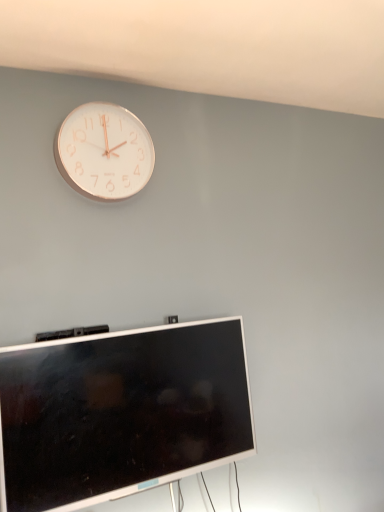
Image resolution: width=384 pixels, height=512 pixels. In order to click on silver metallic television at lower center in this screenshot , I will do `click(120, 413)`.

What do you see at coordinates (120, 413) in the screenshot?
I see `silver metallic television at lower center` at bounding box center [120, 413].

This screenshot has height=512, width=384. What do you see at coordinates (104, 152) in the screenshot? I see `white metallic clock at upper left` at bounding box center [104, 152].

You are a GUI agent. You are given a task and a screenshot of the screen. Output one action in this format:
    pyautogui.click(x=<x>, y=<y>)
    Task: Click on the white metallic clock at upper left
    The image size is (384, 512).
    Given the screenshot: What is the action you would take?
    click(x=104, y=152)

Find the location of a particular element. silver metallic television at lower center is located at coordinates (120, 413).

Which is more to the right, silver metallic television at lower center or white metallic clock at upper left?

From the viewer's perspective, silver metallic television at lower center appears more on the right side.

Is silver metallic television at lower center closer to the viewer compared to white metallic clock at upper left?

Yes, it is.

Is point (59, 365) farther from viewer compared to point (128, 174)?

No, it is in front of (128, 174).

From the image's perspective, would you say silver metallic television at lower center is shown under white metallic clock at upper left?

Yes, from the image's perspective, silver metallic television at lower center is beneath white metallic clock at upper left.

From a real-world perspective, which is physically above, silver metallic television at lower center or white metallic clock at upper left?

white metallic clock at upper left, from a real-world perspective.

Considering the sizes of silver metallic television at lower center and white metallic clock at upper left in the image, is silver metallic television at lower center wider or thinner than white metallic clock at upper left?

In the image, silver metallic television at lower center appears to be wider than white metallic clock at upper left.

Between silver metallic television at lower center and white metallic clock at upper left, which one has less height?

white metallic clock at upper left.

Can you confirm if silver metallic television at lower center is bigger than white metallic clock at upper left?

Indeed, silver metallic television at lower center has a larger size compared to white metallic clock at upper left.

Would you say white metallic clock at upper left is part of silver metallic television at lower center's contents?

No.

Is silver metallic television at lower center far away from white metallic clock at upper left?

silver metallic television at lower center is near white metallic clock at upper left, not far away.

Is silver metallic television at lower center facing away from white metallic clock at upper left?

No, silver metallic television at lower center is not facing the opposite direction of white metallic clock at upper left.

Measure the distance between silver metallic television at lower center and white metallic clock at upper left.

silver metallic television at lower center and white metallic clock at upper left are 23.86 inches apart.

I want to click on wall clock located above the silver metallic television at lower center (from a real-world perspective), so click(104, 152).

Considering the relative positions of white metallic clock at upper left and silver metallic television at lower center in the image provided, is white metallic clock at upper left to the left of silver metallic television at lower center from the viewer's perspective?

Indeed, white metallic clock at upper left is positioned on the left side of silver metallic television at lower center.

Is the depth of white metallic clock at upper left greater than that of silver metallic television at lower center?

Yes, the depth of white metallic clock at upper left is greater than that of silver metallic television at lower center.

Considering the points (100, 181) and (13, 357), which point is in front, point (100, 181) or point (13, 357)?

Positioned in front is point (13, 357).

From the image's perspective, does white metallic clock at upper left appear lower than silver metallic television at lower center?

No, from the image's perspective, white metallic clock at upper left is not beneath silver metallic television at lower center.

From a real-world perspective, is white metallic clock at upper left positioned above or below silver metallic television at lower center?

In terms of real-world spatial position, white metallic clock at upper left is above silver metallic television at lower center.

Is white metallic clock at upper left thinner than silver metallic television at lower center?

Yes.

Based on the photo, considering the sizes of objects white metallic clock at upper left and silver metallic television at lower center in the image provided, who is shorter, white metallic clock at upper left or silver metallic television at lower center?

Standing shorter between the two is white metallic clock at upper left.

Considering the sizes of white metallic clock at upper left and silver metallic television at lower center in the image, is white metallic clock at upper left bigger or smaller than silver metallic television at lower center?

white metallic clock at upper left is smaller than silver metallic television at lower center.

Is white metallic clock at upper left completely or partially outside of silver metallic television at lower center?

Yes, white metallic clock at upper left is located beyond the bounds of silver metallic television at lower center.

Can you see white metallic clock at upper left touching silver metallic television at lower center?

No, white metallic clock at upper left is not beside silver metallic television at lower center.

Is white metallic clock at upper left facing away from silver metallic television at lower center?

No, silver metallic television at lower center is not at the back of white metallic clock at upper left.

In the scene shown: How distant is white metallic clock at upper left from silver metallic television at lower center?

white metallic clock at upper left is 23.86 inches away from silver metallic television at lower center.

Image resolution: width=384 pixels, height=512 pixels. Identify the location of television below the white metallic clock at upper left (from the image's perspective). (120, 413).

Locate an element on the screen. This screenshot has width=384, height=512. television below the white metallic clock at upper left (from a real-world perspective) is located at coordinates (120, 413).

Where is `television that appears on the right of white metallic clock at upper left`? This screenshot has height=512, width=384. television that appears on the right of white metallic clock at upper left is located at coordinates (120, 413).